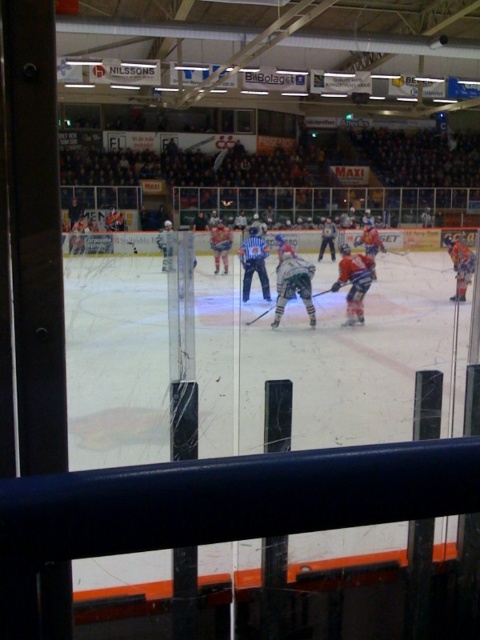
Is shiny silver helmet at center further to camera compared to white jersey at center?

No, it is not.

Looking at this image, is shiny silver helmet at center to the right of white jersey at center from the viewer's perspective?

Correct, you'll find shiny silver helmet at center to the right of white jersey at center.

Does point (292, 291) lie behind point (227, 230)?

No, it is in front of (227, 230).

The height and width of the screenshot is (640, 480). I want to click on shiny silver helmet at center, so click(x=294, y=285).

Is blue jersey at right bigger than white jersey at center?

Yes.

Which is below, blue jersey at right or white jersey at center?

blue jersey at right is lower down.

I want to click on blue jersey at right, so (459, 266).

Based on the photo, can you confirm if blue jersey at center is positioned below blue jersey at right?

Incorrect, blue jersey at center is not positioned below blue jersey at right.

Between point (245, 260) and point (455, 241), which one is positioned in front?

Positioned in front is point (245, 260).

Measure the distance between blue jersey at center and camera.

blue jersey at center and camera are 14.04 meters apart.

Identify the location of blue jersey at center. (253, 262).